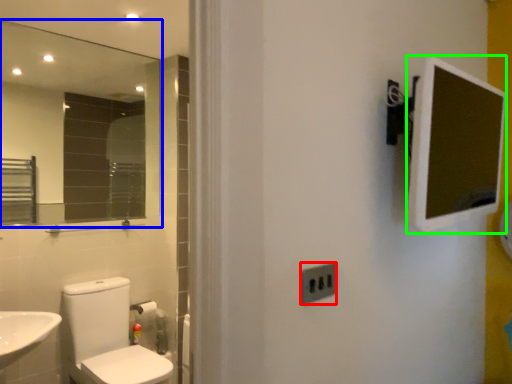
Question: Estimate the real-world distances between objects in this image. Which object is farther from electric outlet (highlighted by a red box), mirror (highlighted by a blue box) or medicine cabinet (highlighted by a green box)?

Choices:
 (A) mirror
 (B) medicine cabinet

Answer: (A)